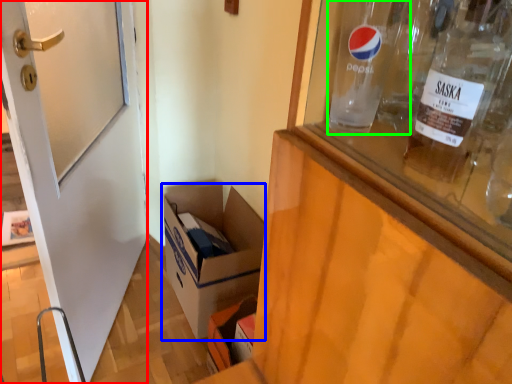
Question: Considering the real-world distances, which object is farthest from door (highlighted by a red box)? box (highlighted by a blue box) or glass bottle (highlighted by a green box)?

Choices:
 (A) box
 (B) glass bottle

Answer: (B)